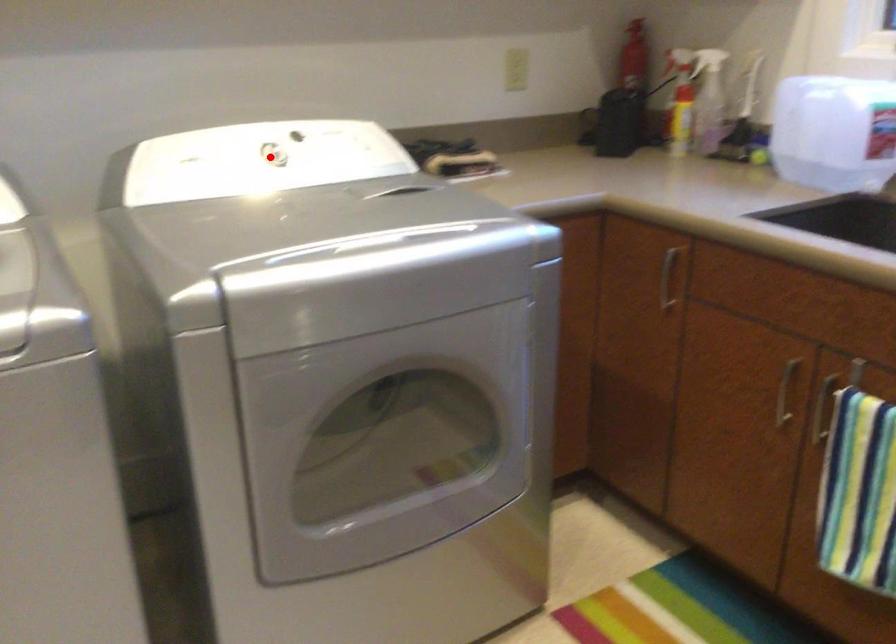
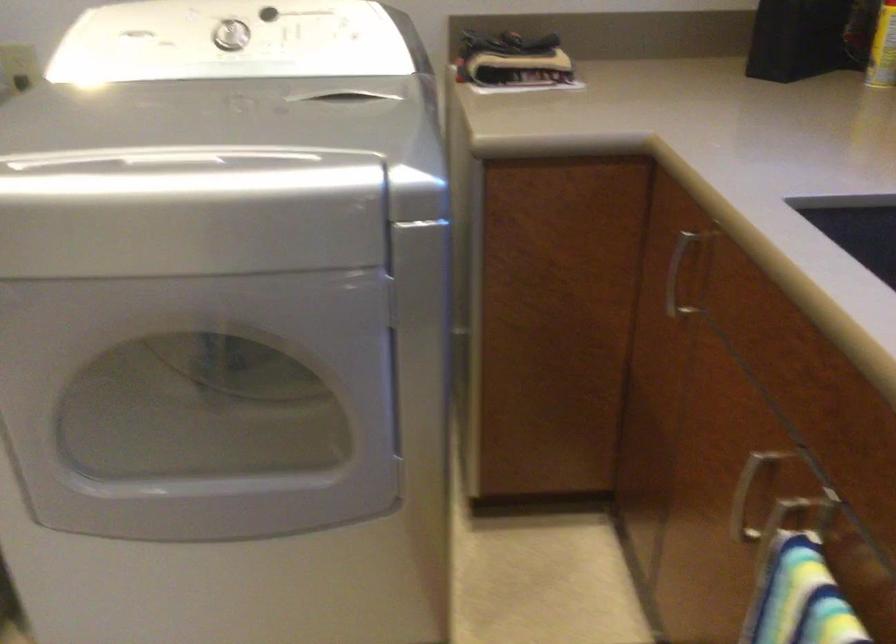
Question: I am providing you with two images of the same scene from different viewpoints. Given a red point in image1, look at the same physical point in image2. Is it:

Choices:
 (A) Closer to the viewpoint
 (B) Farther from the viewpoint

Answer: (A)